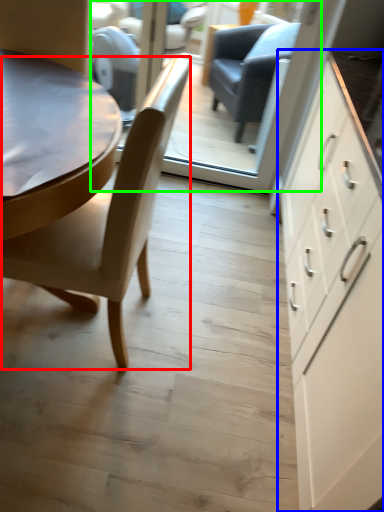
Question: Which object is positioned closest to chair (highlighted by a red box)? Select from cabinetry (highlighted by a blue box) and glass door (highlighted by a green box).

Choices:
 (A) cabinetry
 (B) glass door

Answer: (A)